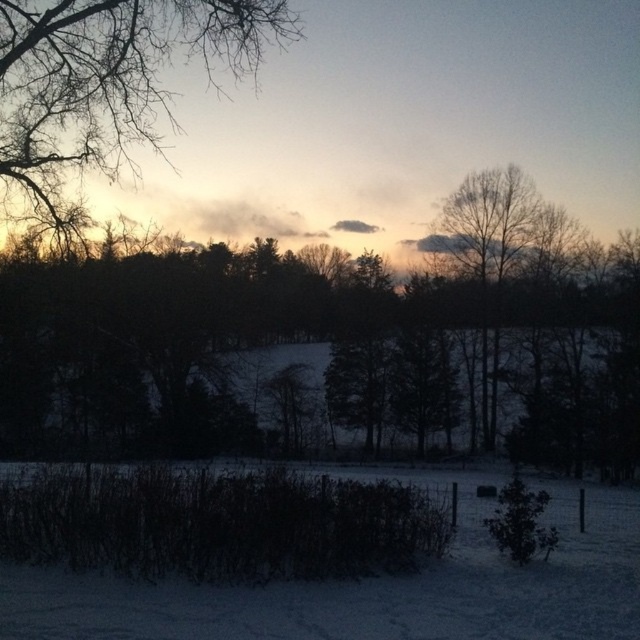
Question: Does white powdery snow at lower center lie behind bare branches at upper left?

Choices:
 (A) yes
 (B) no

Answer: (B)

Question: Which point is closer to the camera?

Choices:
 (A) (29, 76)
 (B) (433, 627)

Answer: (B)

Question: Where is white powdery snow at lower center located in relation to bare branches at upper left in the image?

Choices:
 (A) above
 (B) below

Answer: (B)

Question: Can you confirm if white powdery snow at lower center is smaller than bare branches at upper left?

Choices:
 (A) no
 (B) yes

Answer: (B)